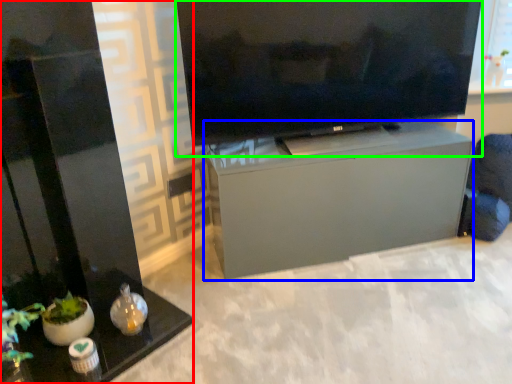
Question: Which object is positioned closest to furniture (highlighted by a red box)? Select from furniture (highlighted by a blue box) and television (highlighted by a green box).

Choices:
 (A) furniture
 (B) television

Answer: (A)